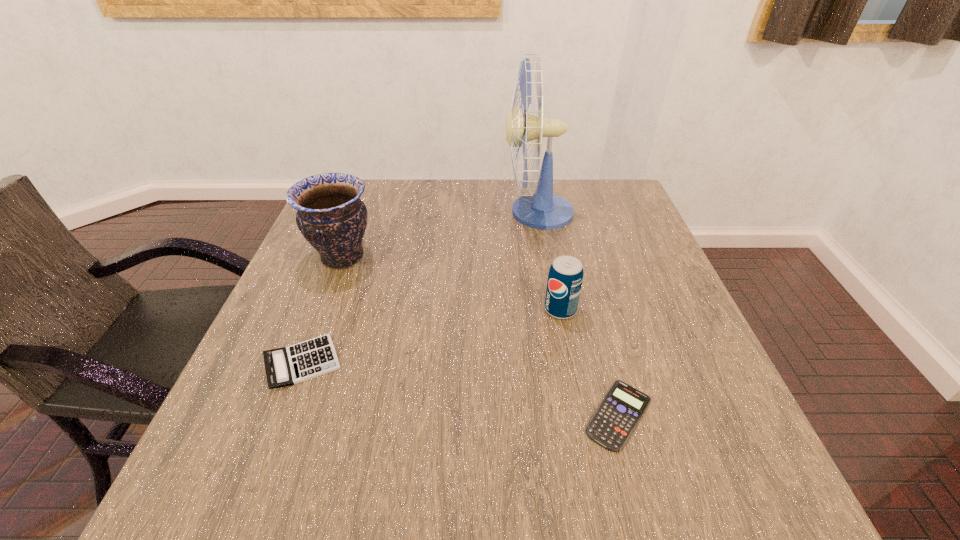
The width and height of the screenshot is (960, 540). In order to click on vacant area that satisfies the following two spatial constraints: 1. on the back side of the third farthest object; 2. on the front handle of the pottery in this screenshot , I will do `click(550, 258)`.

What are the coordinates of `free region that satisfies the following two spatial constraints: 1. at the front of the pop where the blades are visible; 2. on the right side of the tallest object` in the screenshot? It's located at (555, 309).